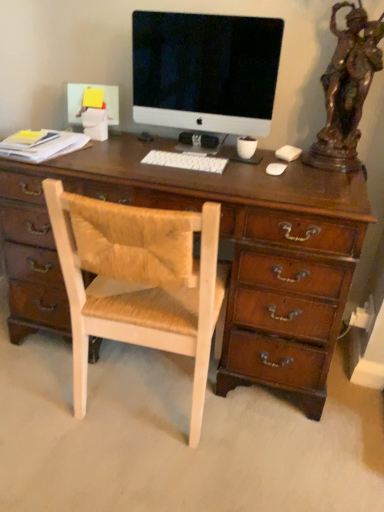
Question: Are satin black monitor at center and white plastic keyboard at center far apart?

Choices:
 (A) no
 (B) yes

Answer: (A)

Question: Is satin black monitor at center facing away from white plastic keyboard at center?

Choices:
 (A) yes
 (B) no

Answer: (B)

Question: Does satin black monitor at center come in front of white plastic keyboard at center?

Choices:
 (A) no
 (B) yes

Answer: (B)

Question: Can you confirm if satin black monitor at center is taller than white plastic keyboard at center?

Choices:
 (A) yes
 (B) no

Answer: (A)

Question: From a real-world perspective, is satin black monitor at center positioned under white plastic keyboard at center based on gravity?

Choices:
 (A) no
 (B) yes

Answer: (A)

Question: Based on their positions, is light wood woven chair at center located to the left or right of satin black monitor at center?

Choices:
 (A) left
 (B) right

Answer: (A)

Question: From their relative heights in the image, would you say light wood woven chair at center is taller or shorter than satin black monitor at center?

Choices:
 (A) tall
 (B) short

Answer: (A)

Question: Considering the positions of point (102, 258) and point (220, 102), is point (102, 258) closer or farther from the camera than point (220, 102)?

Choices:
 (A) farther
 (B) closer

Answer: (B)

Question: Relative to satin black monitor at center, is light wood woven chair at center in front or behind?

Choices:
 (A) front
 (B) behind

Answer: (A)

Question: In terms of height, does white plastic keyboard at center look taller or shorter compared to bronze statue at right?

Choices:
 (A) short
 (B) tall

Answer: (A)

Question: Visually, is white plastic keyboard at center positioned to the left or to the right of bronze statue at right?

Choices:
 (A) right
 (B) left

Answer: (B)

Question: Looking at their shapes, would you say white plastic keyboard at center is wider or thinner than bronze statue at right?

Choices:
 (A) wide
 (B) thin

Answer: (B)

Question: Would you say white plastic keyboard at center is inside or outside bronze statue at right?

Choices:
 (A) outside
 (B) inside

Answer: (A)

Question: Considering the positions of bronze statue at right and satin black monitor at center in the image, is bronze statue at right wider or thinner than satin black monitor at center?

Choices:
 (A) wide
 (B) thin

Answer: (A)

Question: Visually, is bronze statue at right positioned to the left or to the right of satin black monitor at center?

Choices:
 (A) left
 (B) right

Answer: (B)